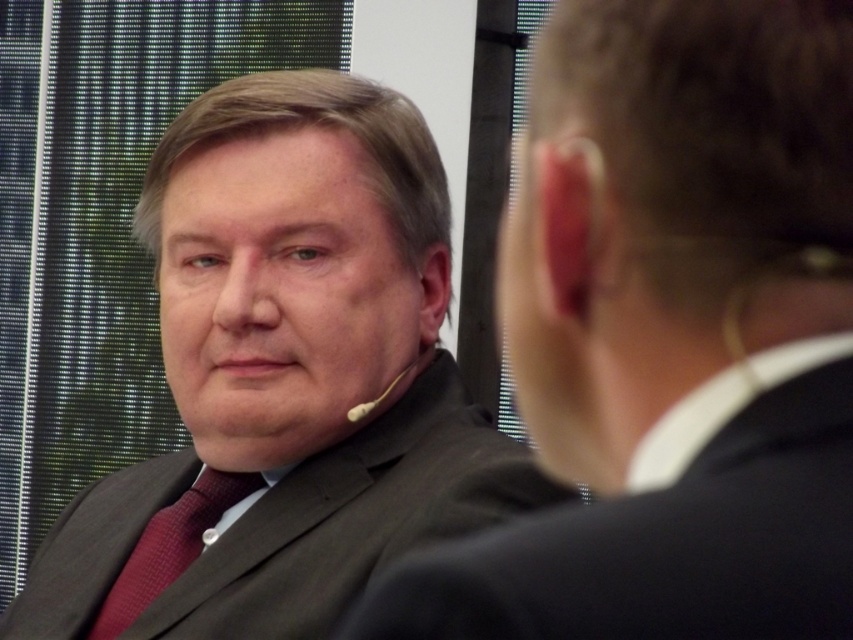
You are a photographer at a conference. You need to take a photo of the dark gray suit at left and the white plastic earbud at left. Which object is positioned higher in the frame?

The dark gray suit at left is positioned higher in the frame than the white plastic earbud at left because it is above it.

You are organizing a charity event and need to seat two guests with different colored suits. The guests are wearing a matte black suit at center and a dark gray suit at center. Which guest should you seat first if you want to accommodate the larger suit first?

The matte black suit at center has a larger size compared to the dark gray suit at center, so you should seat the guest in the matte black suit at center first to accommodate their larger suit.